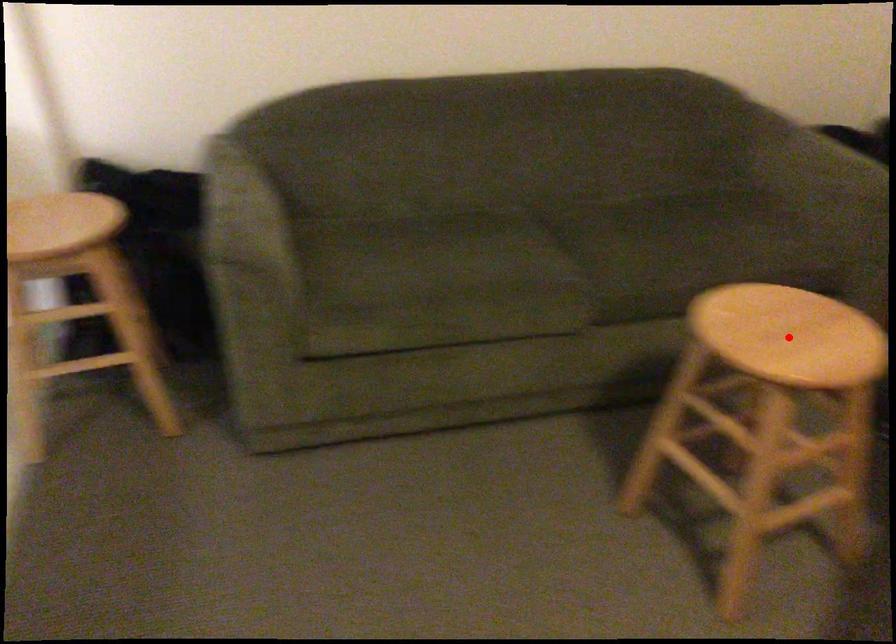
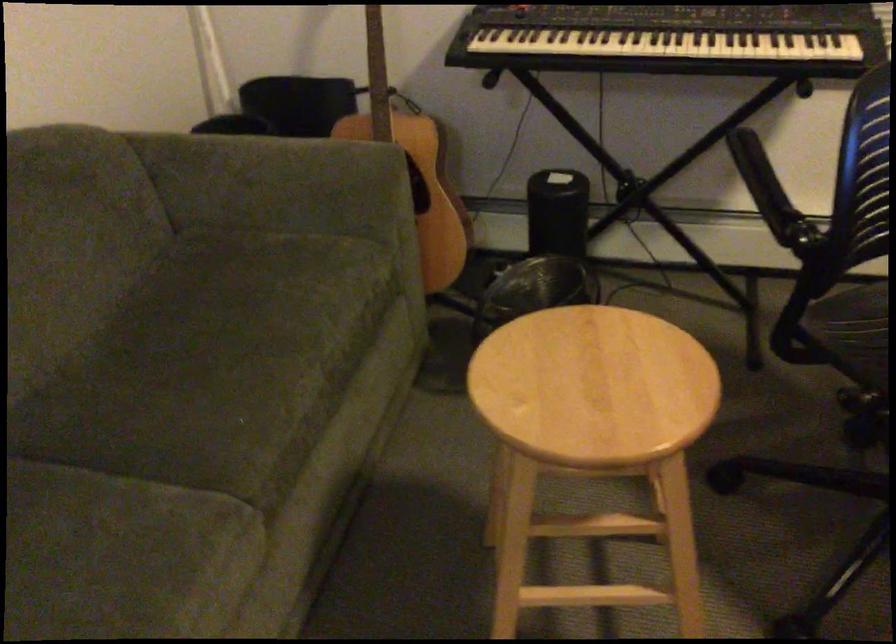
Where in the second image is the point corresponding to the highlighted location from the first image?

(593, 386)